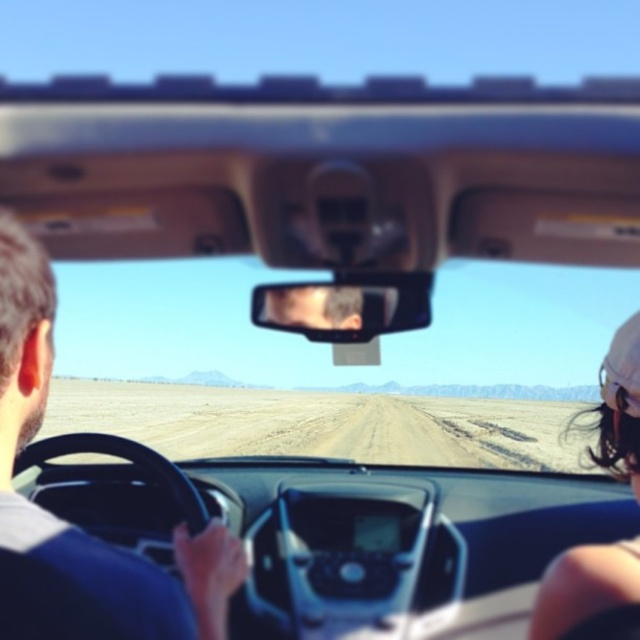
Who is lower down, brown leather steering wheel at left or white fabric cap at right?

white fabric cap at right

Is point (125, 557) behind point (627, 451)?

No, it is in front of (627, 451).

Find the location of a particular element. The image size is (640, 640). brown leather steering wheel at left is located at coordinates (72, 525).

Between brown leather steering wheel at left and clear plastic view mirror at center, which one appears on the right side from the viewer's perspective?

Positioned to the right is clear plastic view mirror at center.

Between brown leather steering wheel at left and clear plastic view mirror at center, which one appears on the left side from the viewer's perspective?

brown leather steering wheel at left is more to the left.

Measure the distance between point (8,280) and camera.

A distance of 4.02 feet exists between point (8,280) and camera.

Locate an element on the screen. brown leather steering wheel at left is located at coordinates (72, 525).

From the picture: Can you confirm if white fabric cap at right is bigger than clear plastic view mirror at center?

Correct, white fabric cap at right is larger in size than clear plastic view mirror at center.

Which is behind, point (566, 560) or point (285, 289)?

The point (285, 289) is more distant.

Between point (630, 452) and point (416, 304), which one is positioned behind?

The point (416, 304) is behind.

At what (x,y) coordinates should I click in order to perform the action: click on white fabric cap at right. Please return your answer as a coordinate pair (x, y). Image resolution: width=640 pixels, height=640 pixels. Looking at the image, I should click on (584, 586).